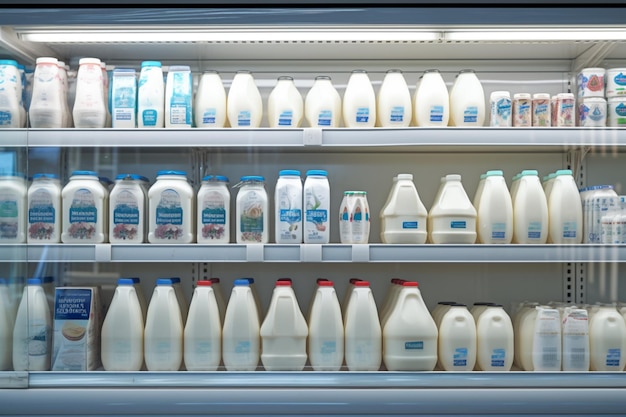
At what (x,y) coordinates should I click in order to perform the action: click on bottles with red lids. Please return your answer as a coordinate pair (x, y). Looking at the image, I should click on (198, 286), (285, 282), (322, 278), (357, 283), (404, 281).